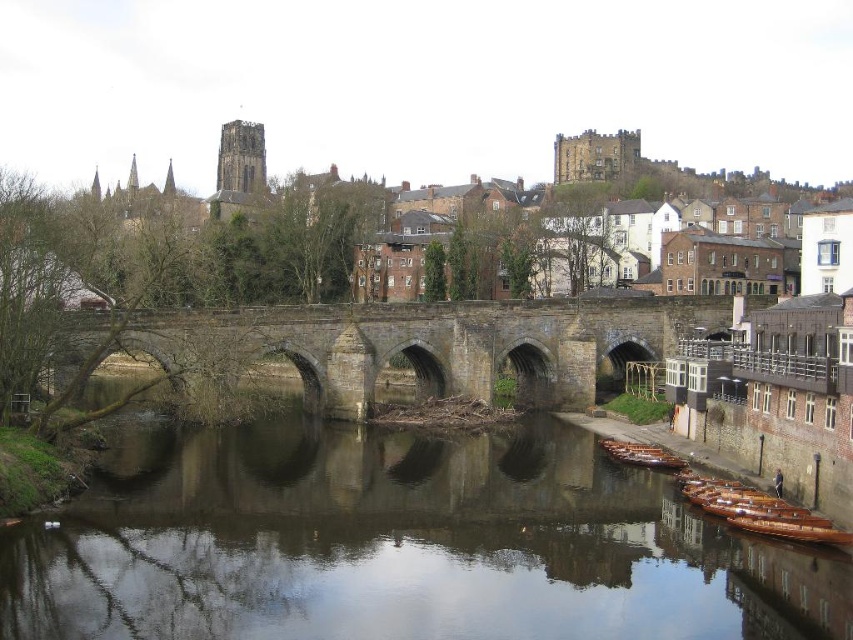
You are an architect analyzing the riverside scene. You need to determine which object occupies a larger area in the image between the smooth brown water at center and the brown stone bridge at center. Based on the scene description, which one is bigger?

The brown stone bridge at center is larger than the smooth brown water at center, as the description states that the smooth brown water at center has a smaller size compared to the brown stone bridge at center.

Looking at this image, you are a boat captain planning to navigate a narrow boat through the river shown in the image. The boat requires a passage that is at least as wide as the brown stone bridge at center. Can the boat safely pass through the area where the smooth brown water at center is located?

The smooth brown water at center has a width less than the brown stone bridge at center, so the boat cannot safely pass through that area since the water is narrower than the required width of the bridge.

You are a tourist planning to cross the brown stone bridge at center to reach the other side of the river. However, you notice the wooden polished boats at lower right are docked nearby. Do you think the bridge has enough width to allow a small cart to pass through comfortably?

The brown stone bridge at center might be wider than wooden polished boats at lower right, so there is a possibility that the bridge is wide enough for a small cart to pass through comfortably.